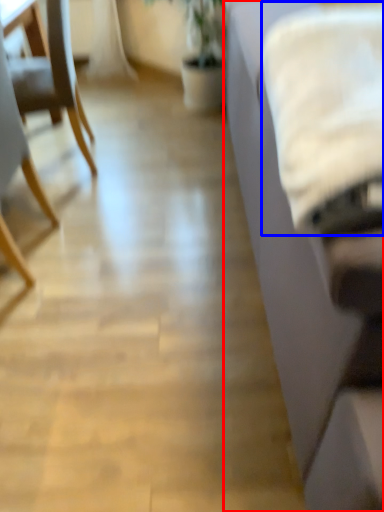
Question: Which point is further to the camera, studio couch (highlighted by a red box) or sheet (highlighted by a blue box)?

Choices:
 (A) studio couch
 (B) sheet

Answer: (B)